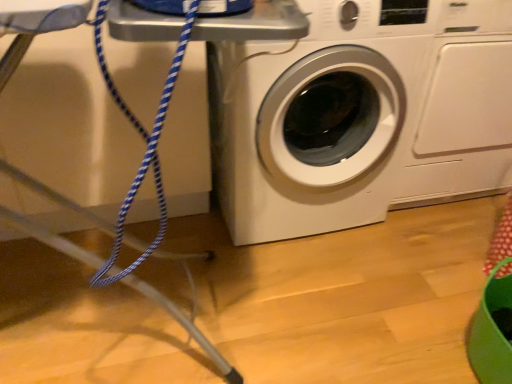
Question: Which direction should I rotate to look at white glossy washing machine at center, which is the 1th washing machine in left-to-right order?

Choices:
 (A) left
 (B) right

Answer: (B)

Question: Does white glossy washing machine at center, which is the 1th washing machine in left-to-right order, come in front of white glossy washing machine at center, the 2th washing machine positioned from the left?

Choices:
 (A) yes
 (B) no

Answer: (A)

Question: From the image's perspective, would you say white glossy washing machine at center, which is the 1th washing machine in left-to-right order, is shown under white glossy washing machine at center, the 2th washing machine positioned from the left?

Choices:
 (A) no
 (B) yes

Answer: (B)

Question: From a real-world perspective, is white glossy washing machine at center, placed as the 2th washing machine when sorted from right to left, physically above white glossy washing machine at center, the first washing machine from the right?

Choices:
 (A) no
 (B) yes

Answer: (B)

Question: Is white glossy washing machine at center, which is the 1th washing machine in left-to-right order, taller than white glossy washing machine at center, the first washing machine from the right?

Choices:
 (A) no
 (B) yes

Answer: (B)

Question: Is white glossy washing machine at center, which is the 1th washing machine in left-to-right order, positioned with its back to white glossy washing machine at center, the first washing machine from the right?

Choices:
 (A) no
 (B) yes

Answer: (A)

Question: Is white glossy washing machine at center, which is the 1th washing machine in left-to-right order, next to white glossy washing machine at center, the first washing machine from the right, and touching it?

Choices:
 (A) yes
 (B) no

Answer: (B)

Question: From a real-world perspective, is white glossy washing machine at center, the first washing machine from the right, below white glossy washing machine at center, which is the 1th washing machine in left-to-right order?

Choices:
 (A) yes
 (B) no

Answer: (A)

Question: Is white glossy washing machine at center, the first washing machine from the right, to the left of white glossy washing machine at center, placed as the 2th washing machine when sorted from right to left, from the viewer's perspective?

Choices:
 (A) yes
 (B) no

Answer: (B)

Question: From the image's perspective, is white glossy washing machine at center, the first washing machine from the right, above white glossy washing machine at center, which is the 1th washing machine in left-to-right order?

Choices:
 (A) no
 (B) yes

Answer: (B)

Question: Is white glossy washing machine at center, which is the 1th washing machine in left-to-right order, at the back of white glossy washing machine at center, the first washing machine from the right?

Choices:
 (A) no
 (B) yes

Answer: (A)

Question: Can you confirm if white glossy washing machine at center, the first washing machine from the right, is positioned to the right of white glossy washing machine at center, which is the 1th washing machine in left-to-right order?

Choices:
 (A) no
 (B) yes

Answer: (B)

Question: Considering the relative sizes of white glossy washing machine at center, the first washing machine from the right, and white glossy washing machine at center, which is the 1th washing machine in left-to-right order, in the image provided, is white glossy washing machine at center, the first washing machine from the right, smaller than white glossy washing machine at center, which is the 1th washing machine in left-to-right order,?

Choices:
 (A) yes
 (B) no

Answer: (A)

Question: Does point tap(474, 26) appear closer or farther from the camera than point tap(374, 221)?

Choices:
 (A) farther
 (B) closer

Answer: (B)